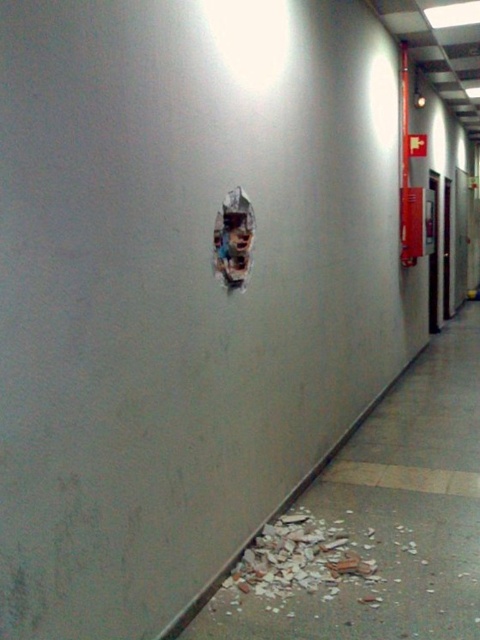
Does crumbly concrete debris at lower center appear under ripped paper at center?

Yes, crumbly concrete debris at lower center is below ripped paper at center.

Is crumbly concrete debris at lower center positioned before ripped paper at center?

Yes, it is.

Between point (328, 544) and point (228, 236), which one is positioned in front?

Point (228, 236) is in front.

Locate an element on the screen. The height and width of the screenshot is (640, 480). crumbly concrete debris at lower center is located at coordinates (305, 563).